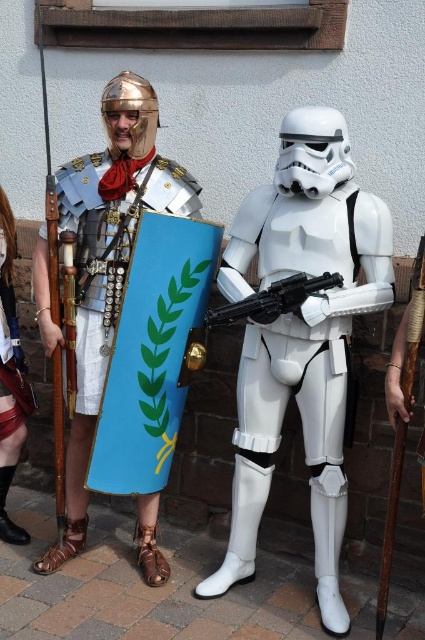
Question: Based on their relative distances, which object is farther from the black plastic blaster at center?

Choices:
 (A) metallic armor at left
 (B) white plastic stormtrooper at center

Answer: (A)

Question: Which of the following is the farthest from the observer?

Choices:
 (A) black plastic blaster at center
 (B) shiny red skirt at lower left
 (C) metallic armor at left

Answer: (B)

Question: Where is white plastic stormtrooper at center located in relation to shiny red skirt at lower left in the image?

Choices:
 (A) above
 (B) below

Answer: (B)

Question: Among these points, which one is farthest from the camera?

Choices:
 (A) (300, 282)
 (B) (142, 496)
 (C) (22, 387)
 (D) (305, 134)

Answer: (C)

Question: Can you confirm if white plastic stormtrooper at center is bigger than shiny red skirt at lower left?

Choices:
 (A) yes
 (B) no

Answer: (A)

Question: Is metallic armor at left further to the viewer compared to shiny red skirt at lower left?

Choices:
 (A) yes
 (B) no

Answer: (B)